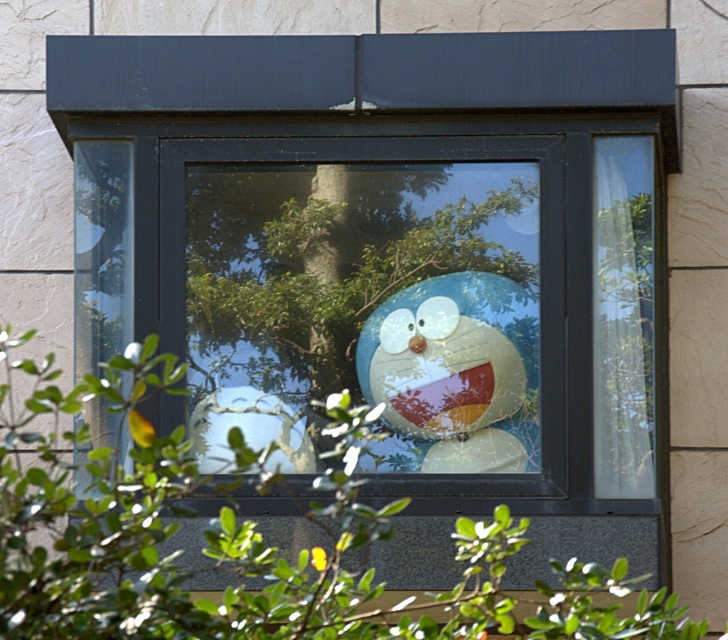
You are an observer looking through the window. You notice the green leafy tree at center and the translucent plastic toy at center. Which object is wider in your view?

The green leafy tree at center is wider than the translucent plastic toy at center.

You are an interior designer arranging a living room. You have a translucent plastic toy at center and a green leafy tree at center. Which object should you place closer to the window to ensure both are visible without one blocking the other?

The translucent plastic toy at center should be placed closer to the window because it is smaller than the green leafy tree at center, allowing both to be visible without obstruction.